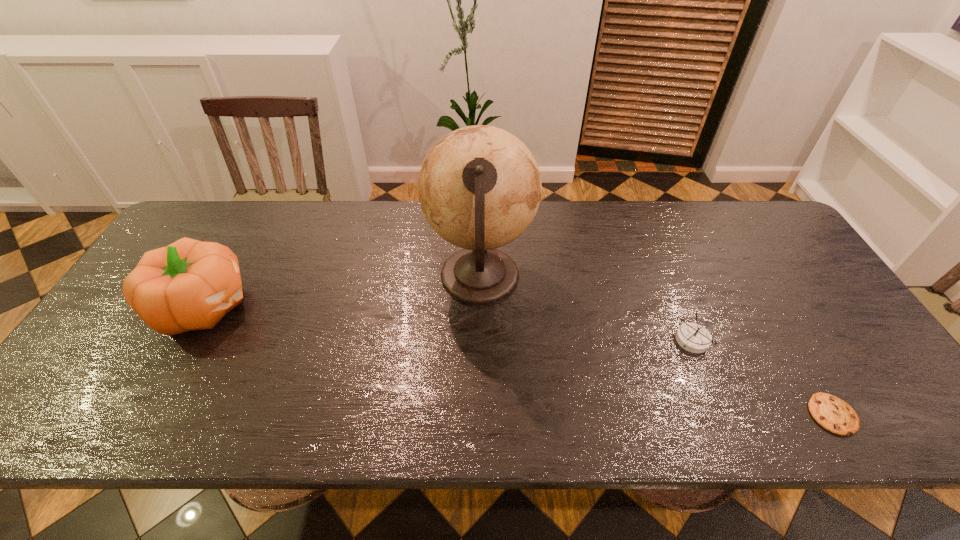
The image size is (960, 540). Find the location of `blank area at the right edge`. blank area at the right edge is located at coordinates (762, 264).

This screenshot has height=540, width=960. In the image, there is a desktop. Find the location of `blank space at the far left corner`. blank space at the far left corner is located at coordinates (205, 233).

What are the coordinates of `vacant space at the far right corner` in the screenshot? It's located at (753, 202).

Image resolution: width=960 pixels, height=540 pixels. Find the location of `empty location between the globe and the third tallest object`. empty location between the globe and the third tallest object is located at coordinates (587, 309).

Image resolution: width=960 pixels, height=540 pixels. Identify the location of unoccupied position between the rightmost object and the third object from left to right. (762, 377).

Image resolution: width=960 pixels, height=540 pixels. Find the location of `free space that is in between the third shortest object and the shortest object`. free space that is in between the third shortest object and the shortest object is located at coordinates (518, 360).

Locate an element on the screen. empty space that is in between the globe and the second shortest object is located at coordinates (587, 309).

In order to click on unoccupied area between the compass and the third shortest object in this screenshot , I will do `click(448, 323)`.

Locate an element on the screen. The image size is (960, 540). vacant space in between the third object from left to right and the nearest object is located at coordinates (762, 377).

You are a GUI agent. You are given a task and a screenshot of the screen. Output one action in this format:
    pyautogui.click(x=<x>, y=<y>)
    Task: Click on the free space that is in between the cookie and the second shortest object
    The image size is (960, 540).
    Given the screenshot: What is the action you would take?
    pyautogui.click(x=762, y=377)